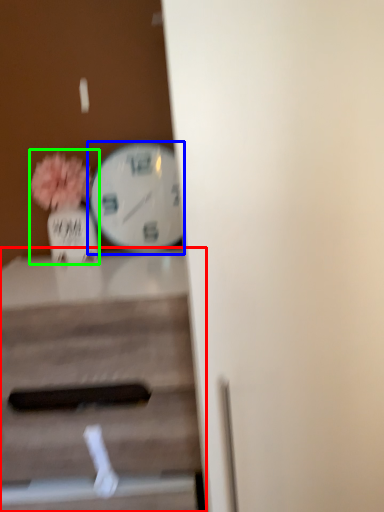
Question: Estimate the real-world distances between objects in this image. Which object is farther from table (highlighted by a red box), wall clock (highlighted by a blue box) or floral arrangement (highlighted by a green box)?

Choices:
 (A) wall clock
 (B) floral arrangement

Answer: (A)